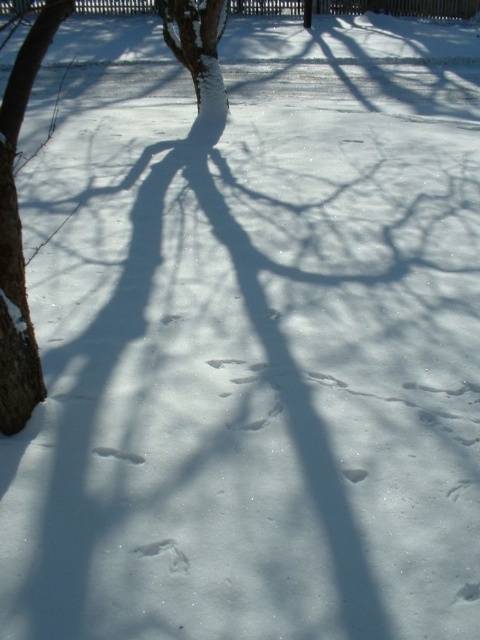
The width and height of the screenshot is (480, 640). Describe the element at coordinates (20, 234) in the screenshot. I see `brown rough bark tree at left` at that location.

How distant is brown rough bark tree at left from white snow-covered tree at center?

20.89 feet

Locate an element on the screen. This screenshot has height=640, width=480. brown rough bark tree at left is located at coordinates (20, 234).

The width and height of the screenshot is (480, 640). What are the coordinates of `brown rough bark tree at left` in the screenshot? It's located at (20, 234).